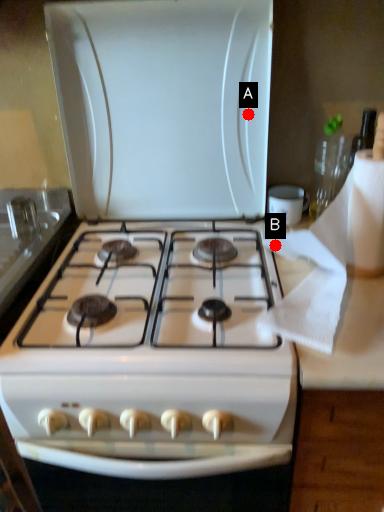
Question: Two points are circled on the image, labeled by A and B beside each circle. Which point is closer to the camera taking this photo?

Choices:
 (A) A is closer
 (B) B is closer

Answer: (B)